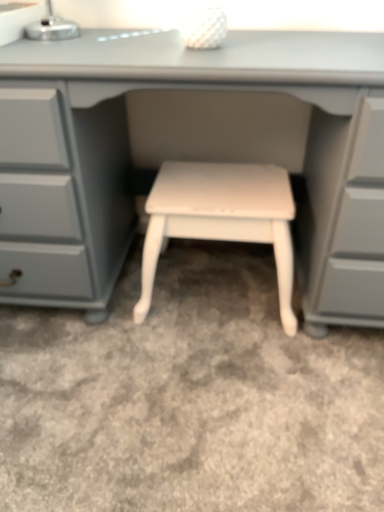
Image resolution: width=384 pixels, height=512 pixels. I want to click on free point above white painted wood stool at center (from a real-world perspective), so click(x=216, y=185).